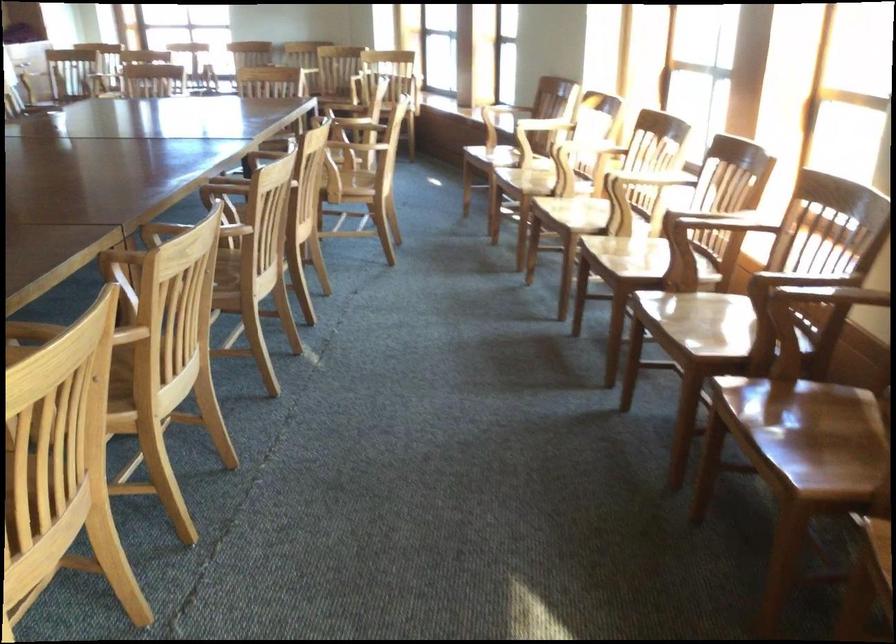
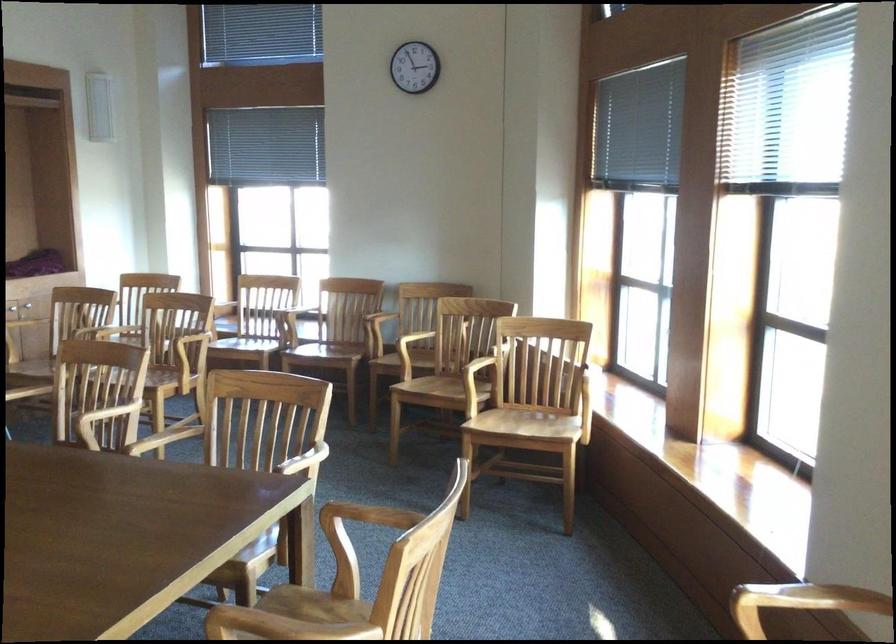
Question: The images are taken continuously from a first-person perspective. In which direction are you moving?

Choices:
 (A) Left
 (B) Right
 (C) Forward
 (D) Backward

Answer: (C)